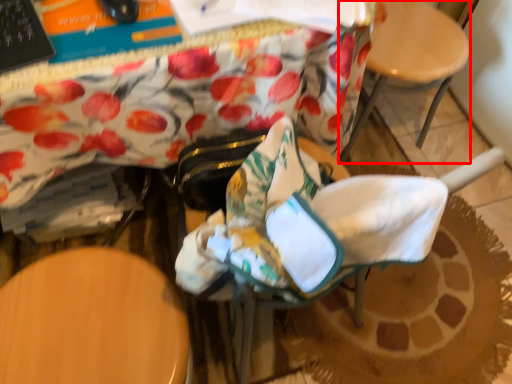
Question: From the image's perspective, where is chair (annotated by the red box) located relative to rocking chair?

Choices:
 (A) below
 (B) above

Answer: (B)